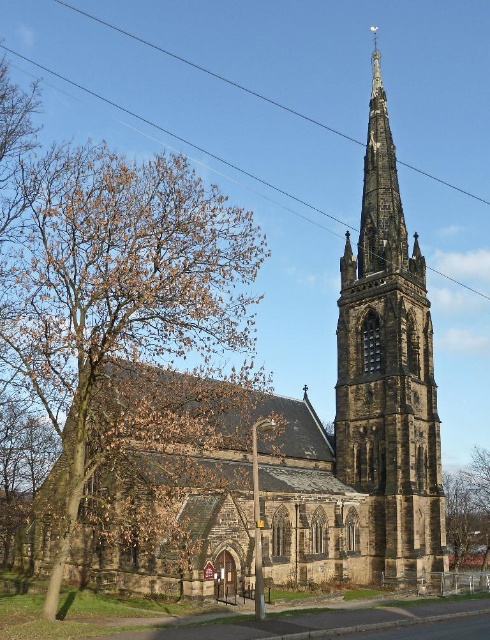
Question: Is brown leafy tree at lower right thinner than black wire at upper center?

Choices:
 (A) yes
 (B) no

Answer: (A)

Question: Which of the following is the closest to the observer?

Choices:
 (A) (413, 557)
 (B) (127, 113)

Answer: (A)

Question: Does brown leafy tree at left appear under brown leafy tree at lower right?

Choices:
 (A) no
 (B) yes

Answer: (A)

Question: Based on their relative distances, which object is farther from the brown leafy tree at left?

Choices:
 (A) brown stone spire at center
 (B) black wire at upper center

Answer: (B)

Question: Does brown stone spire at center lie behind brown leafy tree at lower right?

Choices:
 (A) no
 (B) yes

Answer: (A)

Question: Which point appears farthest from the camera in this image?

Choices:
 (A) (466, 474)
 (B) (351, 364)
 (C) (119, 168)
 (D) (459, 282)

Answer: (D)